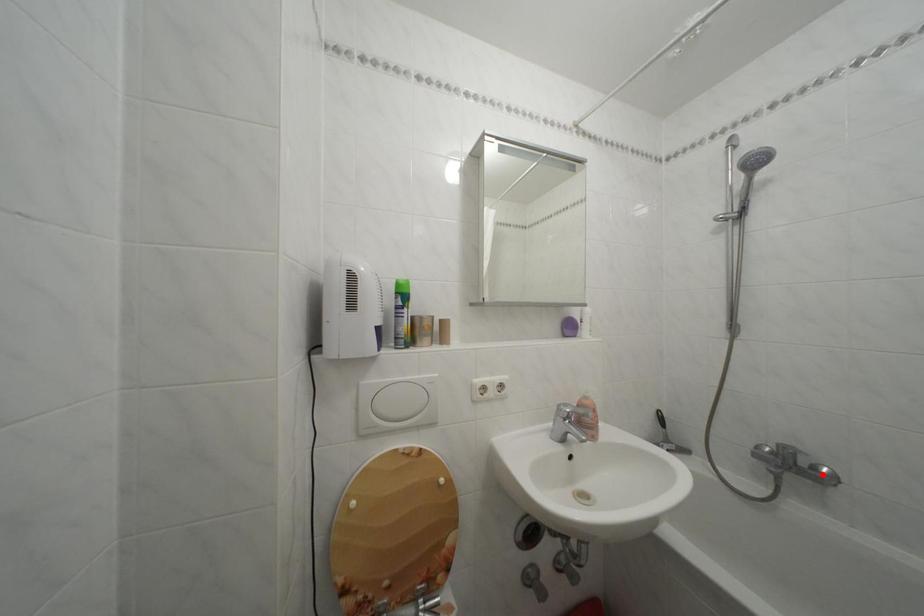
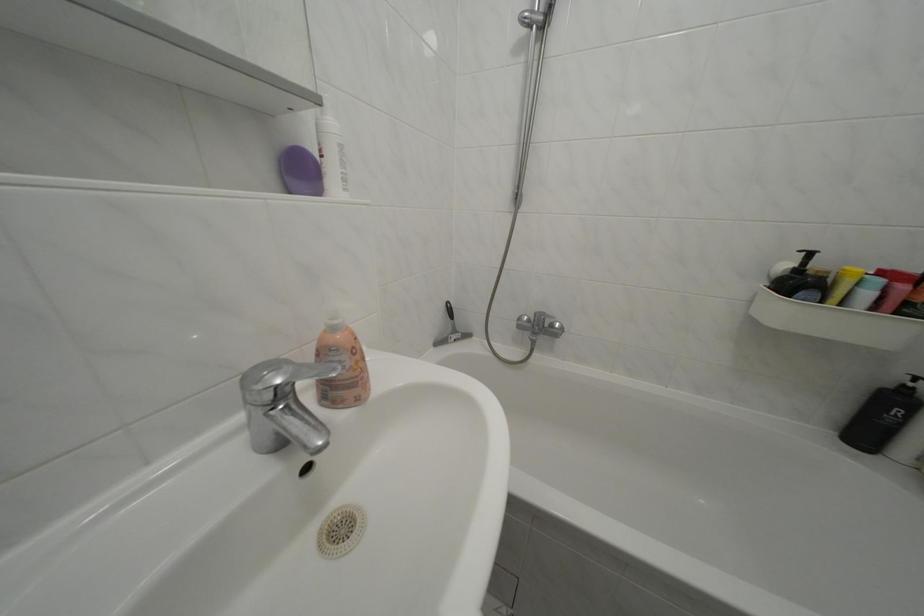
Where in the second image is the point corresponding to the highlighted location from the first image?

(562, 331)